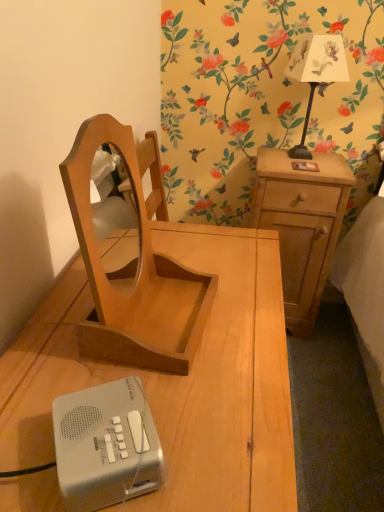
The height and width of the screenshot is (512, 384). Find the location of `vacant area to the left of white paper lampshade at upper right`. vacant area to the left of white paper lampshade at upper right is located at coordinates (263, 160).